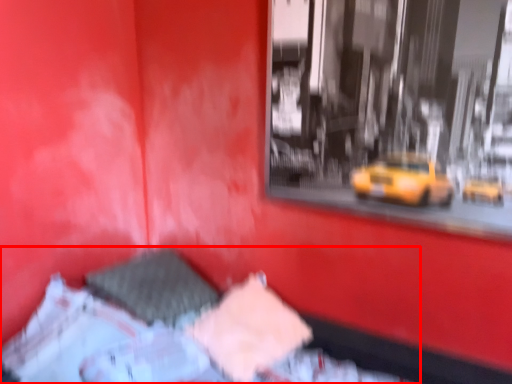
Question: In this image, where is bed (annotated by the red box) located relative to sheet?

Choices:
 (A) left
 (B) right

Answer: (A)